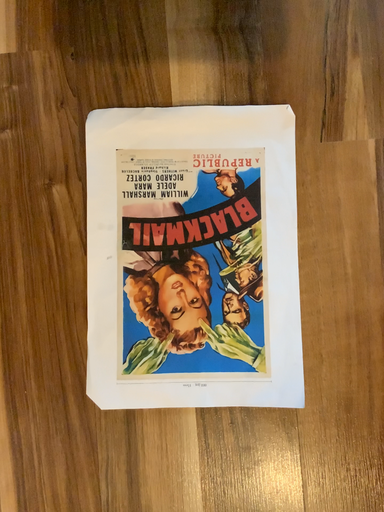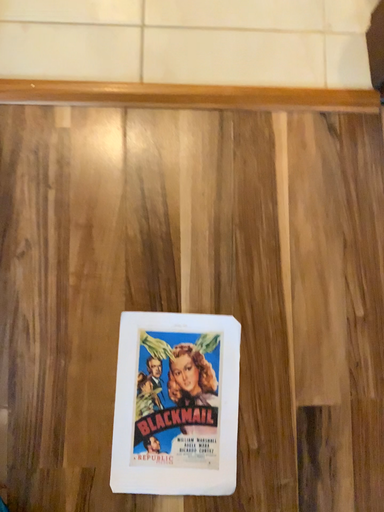
Question: Which way did the camera rotate in the video?

Choices:
 (A) rotated upward
 (B) rotated downward

Answer: (A)